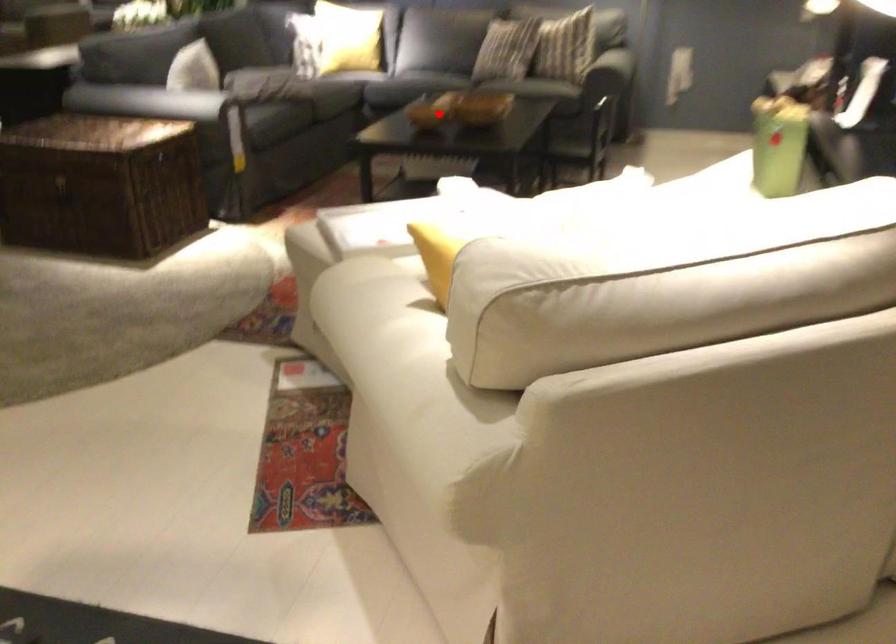
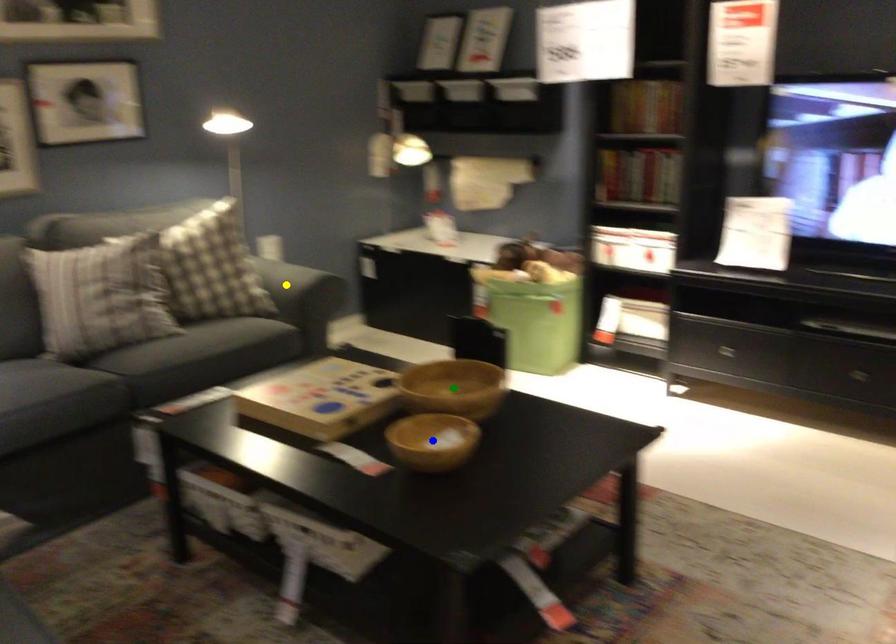
Question: I am providing you with two images of the same scene from different viewpoints. A red point is marked on the first image. You are given multiple points on the second image. Can you choose the point in image 2 that corresponds to the point in image 1?

Choices:
 (A) yellow point
 (B) blue point
 (C) green point

Answer: (B)